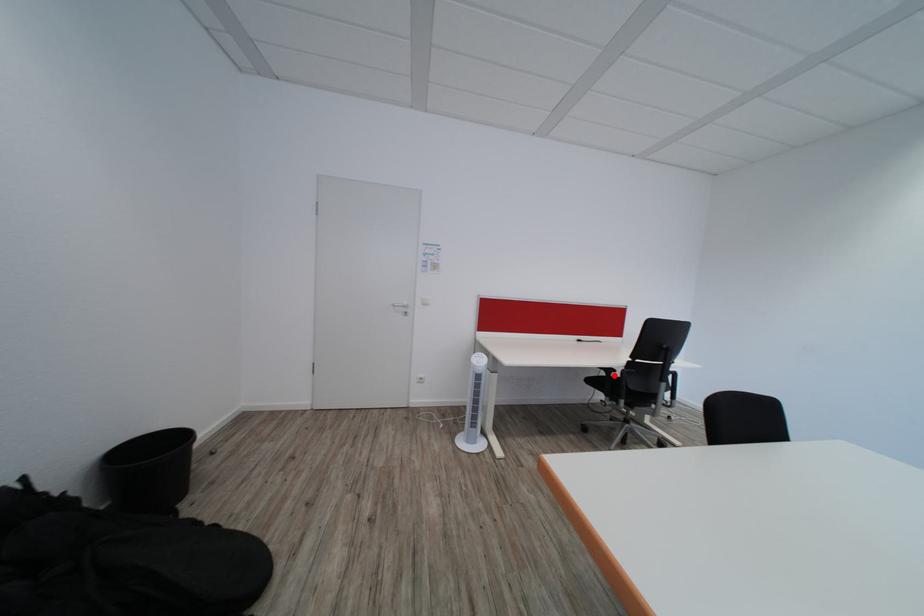
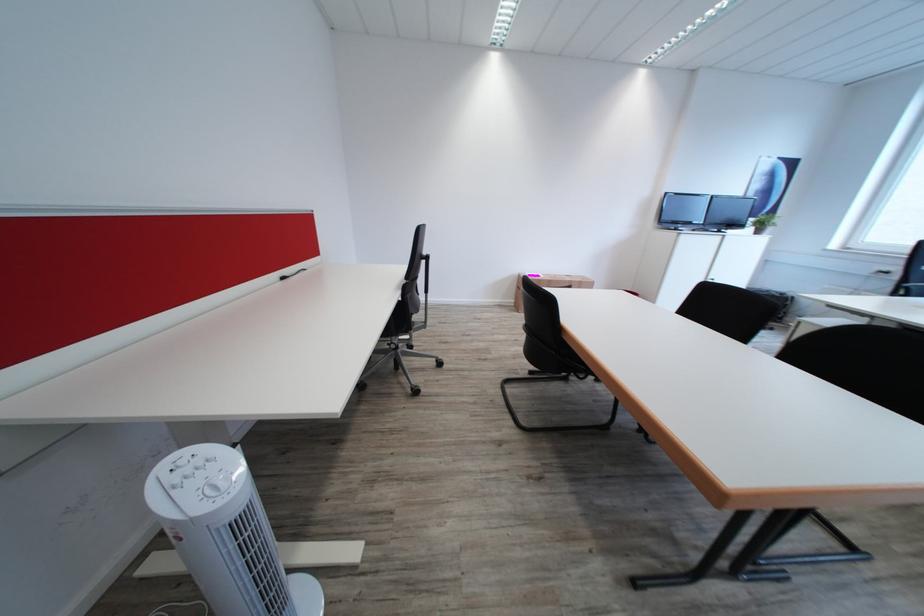
Question: I am providing you with two images of the same scene from different viewpoints. A red point is marked on the first image. At the location where the point appears in image 1, is it still visible in image 2?

Choices:
 (A) Yes
 (B) No

Answer: (B)